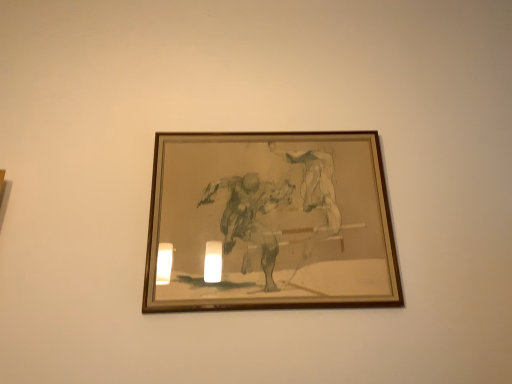
What is the approximate height of wooden framed drawing at center?

The height of wooden framed drawing at center is 22.29 inches.

This screenshot has width=512, height=384. Describe the element at coordinates (269, 223) in the screenshot. I see `wooden framed drawing at center` at that location.

This screenshot has width=512, height=384. Identify the location of wooden framed drawing at center. (269, 223).

Find the location of a particular element. The height and width of the screenshot is (384, 512). wooden framed drawing at center is located at coordinates (269, 223).